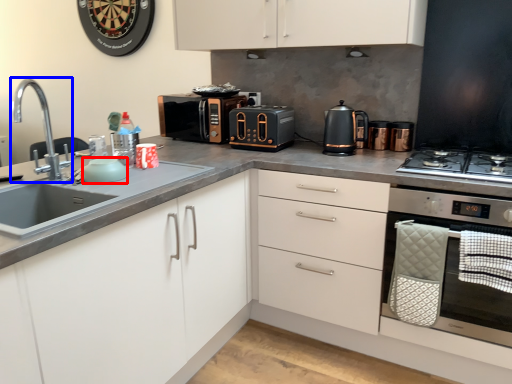
Question: Which object is closer to the camera taking this photo, appliance (highlighted by a red box) or tap (highlighted by a blue box)?

Choices:
 (A) appliance
 (B) tap

Answer: (B)